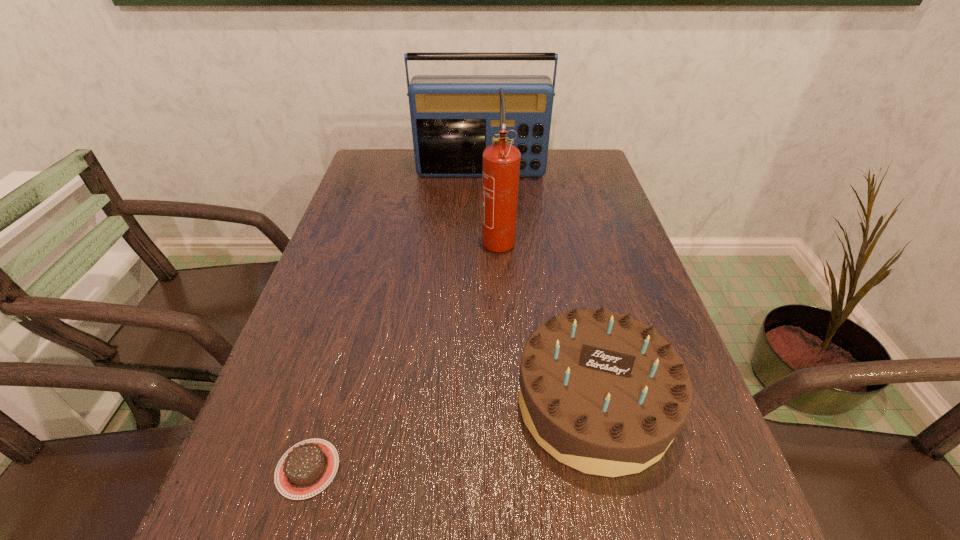
Where is `vacant space that's between the birthday cake and the second farthest object`? This screenshot has width=960, height=540. vacant space that's between the birthday cake and the second farthest object is located at coordinates (546, 320).

Identify the location of unoccupied position between the second farthest object and the chocolate cake. This screenshot has width=960, height=540. (403, 353).

This screenshot has width=960, height=540. In order to click on vacant area between the radio receiver and the birthday cake in this screenshot , I will do `click(538, 287)`.

Identify which object is located as the nearest to the leftmost object. Please provide its 2D coordinates. Your answer should be formatted as a tuple, i.e. [(x, y)], where the tuple contains the x and y coordinates of a point satisfying the conditions above.

[(603, 393)]

Point out which object is positioned as the third nearest to the radio receiver. Please provide its 2D coordinates. Your answer should be formatted as a tuple, i.e. [(x, y)], where the tuple contains the x and y coordinates of a point satisfying the conditions above.

[(307, 468)]